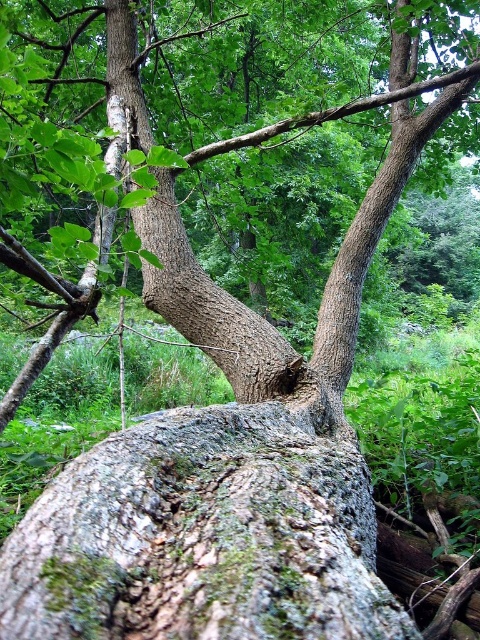
Between green mossy rock at center and rough bark tree at center, which one appears on the right side from the viewer's perspective?

From the viewer's perspective, green mossy rock at center appears more on the right side.

Is green mossy rock at center taller than rough bark tree at center?

In fact, green mossy rock at center may be shorter than rough bark tree at center.

Does point (367, 586) come in front of point (243, 305)?

Yes, it is in front of point (243, 305).

Locate an element on the screen. green mossy rock at center is located at coordinates coord(203,538).